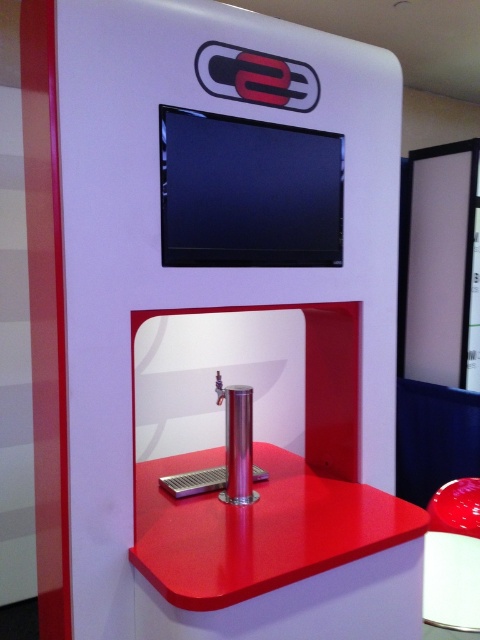
Is shiny red table at center shorter than glossy plastic stool at lower right?

No, shiny red table at center is not shorter than glossy plastic stool at lower right.

Is the position of shiny red table at center less distant than that of glossy plastic stool at lower right?

Yes, shiny red table at center is closer to the viewer.

This screenshot has height=640, width=480. In order to click on shiny red table at center in this screenshot , I will do `click(276, 556)`.